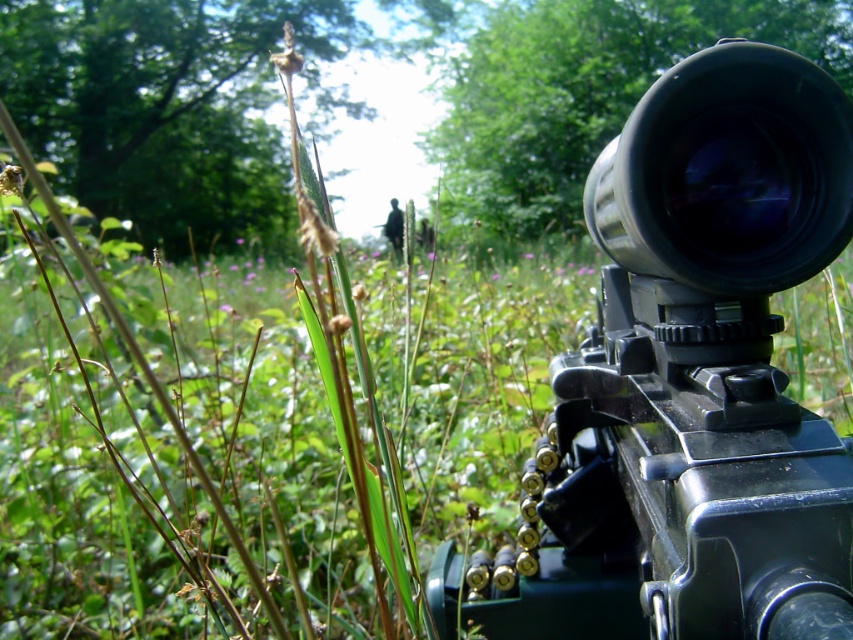
Question: Does matte black rifle at center have a greater width compared to black matte lens at upper right?

Choices:
 (A) no
 (B) yes

Answer: (B)

Question: Is matte black rifle at center bigger than black matte lens at upper right?

Choices:
 (A) yes
 (B) no

Answer: (A)

Question: Which object appears farthest from the camera in this image?

Choices:
 (A) matte black rifle at center
 (B) black matte lens at upper right

Answer: (B)

Question: Which point is farther to the camera?

Choices:
 (A) (601, 532)
 (B) (802, 259)

Answer: (A)

Question: Is matte black rifle at center thinner than black matte lens at upper right?

Choices:
 (A) no
 (B) yes

Answer: (A)